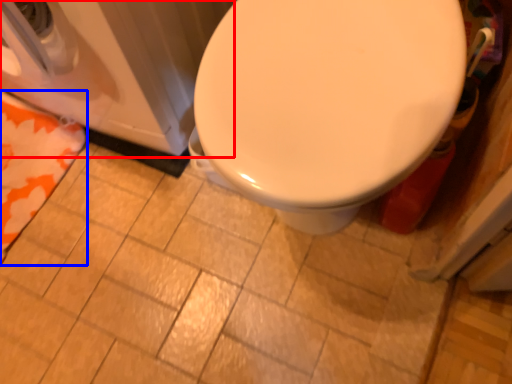
Question: Which object is further to the camera taking this photo, washer (highlighted by a red box) or beach towel (highlighted by a blue box)?

Choices:
 (A) washer
 (B) beach towel

Answer: (B)